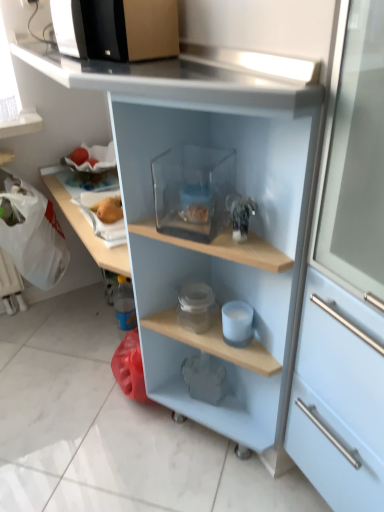
Question: Considering the positions of transparent glass container at center, arranged as the first appliance when viewed from the top, and black plastic microwave at upper left in the image, is transparent glass container at center, arranged as the first appliance when viewed from the top, bigger or smaller than black plastic microwave at upper left?

Choices:
 (A) small
 (B) big

Answer: (A)

Question: Considering their positions, is transparent glass container at center, the third appliance in the back-to-front sequence, located in front of or behind black plastic microwave at upper left?

Choices:
 (A) behind
 (B) front

Answer: (B)

Question: Which is farther from the matte gray elephant at lower center, which is the third appliance in top-to-bottom order?

Choices:
 (A) yellow matte apple at upper left
 (B) white matte cup at center, which is the second appliance in front-to-back order
 (C) transparent plastic container at center
 (D) black plastic microwave at upper left
 (E) transparent glass container at center, marked as the 1th appliance in a front-to-back arrangement

Answer: (D)

Question: Which of these objects is positioned closest to the transparent glass container at center, marked as the 1th appliance in a front-to-back arrangement?

Choices:
 (A) matte gray elephant at lower center, which is counted as the 1th appliance, starting from the back
 (B) white matte cup at center, the second appliance viewed from the back
 (C) black plastic microwave at upper left
 (D) yellow matte apple at upper left
 (E) transparent plastic container at center

Answer: (E)